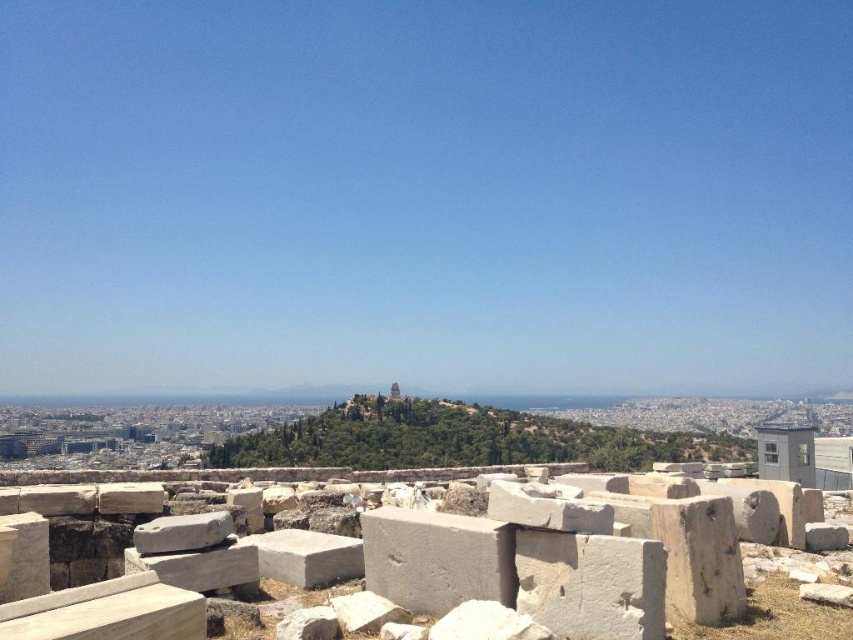
You are an archaeologist standing at the edge of the white stone ruins at center. You want to reach the top of the green leafy hillside at center to get a better view. Which object will you have to climb over or around?

The green leafy hillside at center is taller than the white stone ruins at center, so you will need to climb over or around the green leafy hillside at center to reach its top.

From the picture: You are standing at the ancient ruin site and want to determine which of the two points, point (703, 518) or point (595, 451), is nearer to you. Based on the scene, which point is closer?

Point (703, 518) is closer to the viewer than point (595, 451).

You are an archaeologist standing at the edge of the ancient site. You need to reach the green leafy hillside at center to collect samples. Which direction should you move relative to the white stone ruins at center?

You should move to the right side of the white stone ruins at center to reach the green leafy hillside at center, as the green leafy hillside at center is positioned on the right side of the white stone ruins at center.